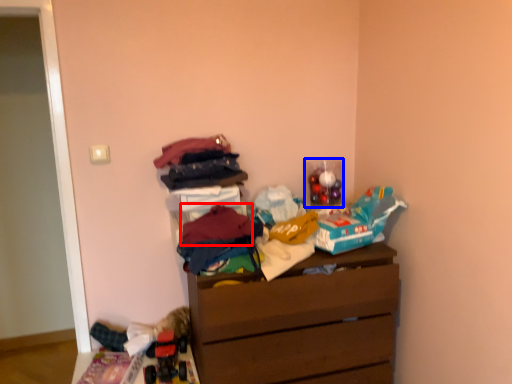
Question: Among these objects, which one is nearest to the camera, clothing (highlighted by a red box) or toy (highlighted by a blue box)?

Choices:
 (A) clothing
 (B) toy

Answer: (A)